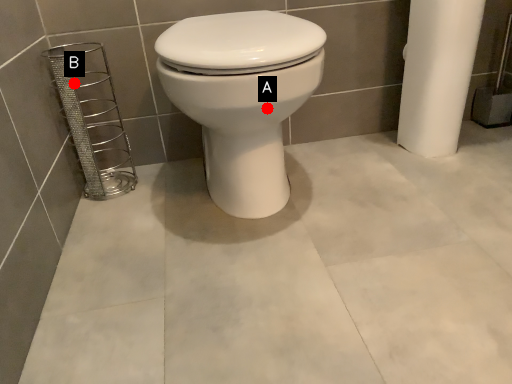
Question: Two points are circled on the image, labeled by A and B beside each circle. Which point is farther from the camera taking this photo?

Choices:
 (A) A is further
 (B) B is further

Answer: (B)